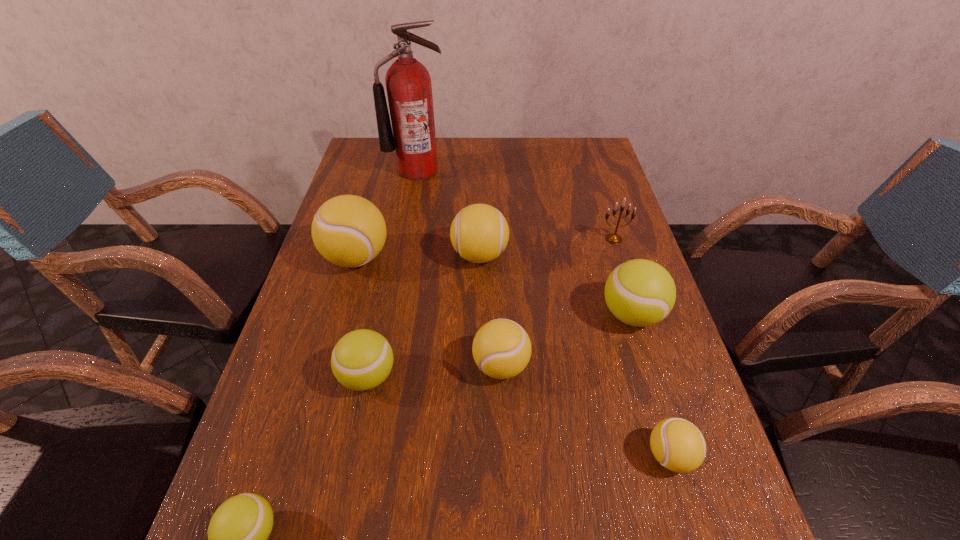
This screenshot has width=960, height=540. Find the location of `vacant space located 0.120m on the back of the smallest yellow tennis ball`. vacant space located 0.120m on the back of the smallest yellow tennis ball is located at coordinates (646, 376).

Where is `object located in the far edge section of the desktop`? object located in the far edge section of the desktop is located at coordinates (409, 90).

Where is `fire extinguisher situated at the left edge`? This screenshot has width=960, height=540. fire extinguisher situated at the left edge is located at coordinates (409, 90).

Where is `candelabrum present at the right edge`? candelabrum present at the right edge is located at coordinates (613, 238).

Locate an element on the screen. The height and width of the screenshot is (540, 960). object at the far left corner is located at coordinates tap(409, 90).

Identify the location of vacant region at the far edge of the desktop. (508, 150).

You are a GUI agent. You are given a task and a screenshot of the screen. Output one action in this format:
    pyautogui.click(x=<x>, y=<y>)
    Task: Click on the vacant space at the left edge
    
    Given the screenshot: What is the action you would take?
    pyautogui.click(x=344, y=276)

Locate an element on the screen. Image resolution: width=960 pixels, height=540 pixels. vacant space at the far right corner of the desktop is located at coordinates (570, 166).

This screenshot has height=540, width=960. Find the location of `blank region between the tallest tennis ball and the second biggest green tennis ball`. blank region between the tallest tennis ball and the second biggest green tennis ball is located at coordinates (363, 317).

Image resolution: width=960 pixels, height=540 pixels. What are the coordinates of `free point between the tallest tennis ball and the farthest object` in the screenshot? It's located at (387, 214).